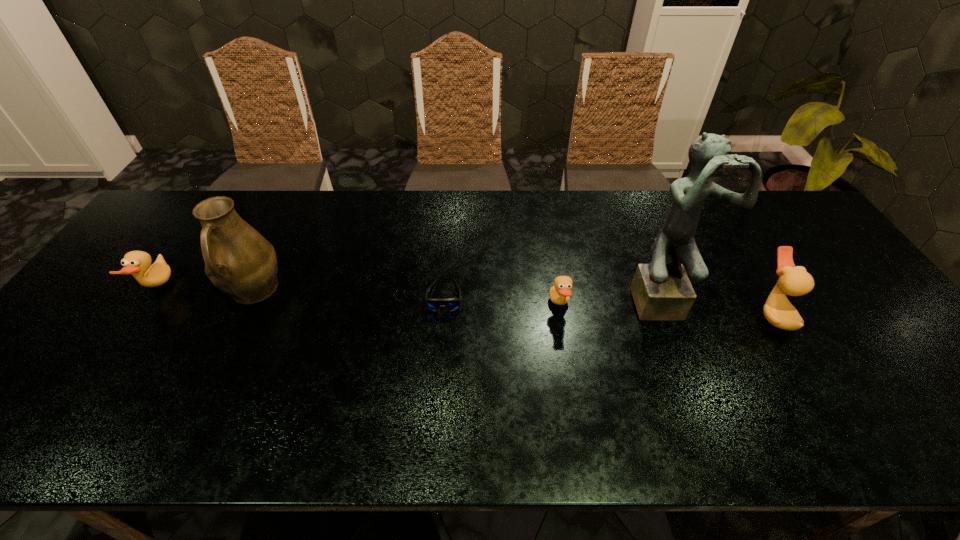
Locate an element on the screen. The height and width of the screenshot is (540, 960). the third object from left to right is located at coordinates click(x=451, y=304).

I want to click on the shortest object, so click(451, 304).

Locate an element on the screen. vacant space situated 0.340m on the beak of the fourth tallest object is located at coordinates (292, 287).

I want to click on vacant area located 0.380m on the beak of the fifth tallest object, so click(711, 305).

Locate an element on the screen. The height and width of the screenshot is (540, 960). vacant position located on the beak of the tallest duck is located at coordinates (604, 314).

Identify the location of vacant region located 0.350m on the beak of the tallest duck. (623, 314).

Image resolution: width=960 pixels, height=540 pixels. Find the location of `free space located on the beak of the tallest duck`. free space located on the beak of the tallest duck is located at coordinates (673, 314).

The height and width of the screenshot is (540, 960). What are the coordinates of `free spot located 0.110m on the face of the sculpture` in the screenshot? It's located at (684, 359).

Find the location of a particular element. The height and width of the screenshot is (540, 960). free spot located 0.100m on the handle side of the second tallest object is located at coordinates (225, 350).

Where is `vacant region located 0.160m on the front-facing side of the third object from left to right`? vacant region located 0.160m on the front-facing side of the third object from left to right is located at coordinates (439, 366).